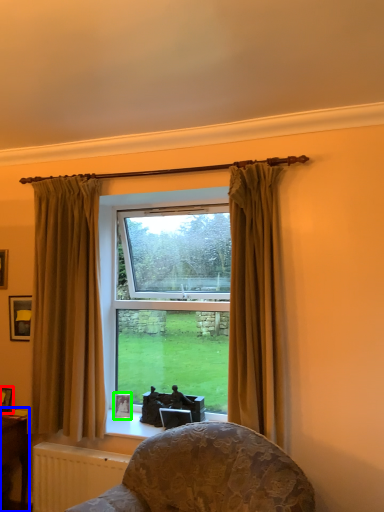
Question: Which object is positioned farthest from picture frame (highlighted by a red box)? Select from table (highlighted by a blue box) and picture frame (highlighted by a green box).

Choices:
 (A) table
 (B) picture frame

Answer: (B)